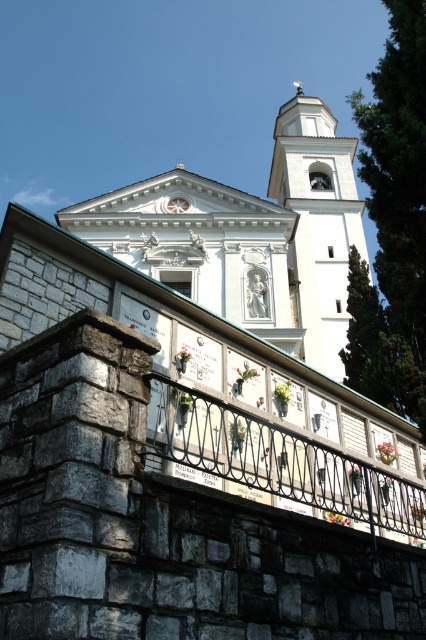
Measure the distance between point (x=287, y=435) and camera.

Point (x=287, y=435) is 25.25 meters from camera.

Can you confirm if black wrought iron railing at center is positioned to the right of white stone bell tower at upper center?

In fact, black wrought iron railing at center is to the left of white stone bell tower at upper center.

What do you see at coordinates (276, 464) in the screenshot? Image resolution: width=426 pixels, height=640 pixels. I see `black wrought iron railing at center` at bounding box center [276, 464].

At what (x,y) coordinates should I click in order to perform the action: click on black wrought iron railing at center. Please return your answer as a coordinate pair (x, y). Looking at the image, I should click on (276, 464).